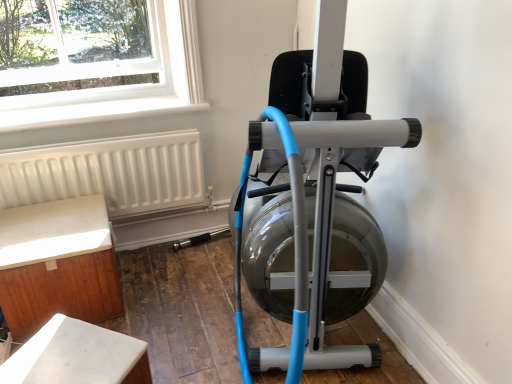
Question: Would you say matte silver stationary bicycle at center is outside white matte radiator at lower left?

Choices:
 (A) no
 (B) yes

Answer: (B)

Question: From a real-world perspective, is matte silver stationary bicycle at center on top of white matte radiator at lower left?

Choices:
 (A) no
 (B) yes

Answer: (B)

Question: Is matte silver stationary bicycle at center further to the viewer compared to white matte radiator at lower left?

Choices:
 (A) yes
 (B) no

Answer: (B)

Question: Is matte silver stationary bicycle at center facing towards white matte radiator at lower left?

Choices:
 (A) yes
 (B) no

Answer: (B)

Question: Does matte silver stationary bicycle at center have a greater width compared to white matte radiator at lower left?

Choices:
 (A) yes
 (B) no

Answer: (A)

Question: Relative to white marble table at lower left, arranged as the 1th furniture when viewed from the front, is white wood cabinet at lower left, which is counted as the first furniture, starting from the back, in front or behind?

Choices:
 (A) behind
 (B) front

Answer: (A)

Question: From a real-world perspective, relative to white marble table at lower left, which is counted as the second furniture, starting from the back, is white wood cabinet at lower left, which is counted as the first furniture, starting from the back, vertically above or below?

Choices:
 (A) above
 (B) below

Answer: (A)

Question: Is point (31, 284) closer or farther from the camera than point (18, 360)?

Choices:
 (A) farther
 (B) closer

Answer: (A)

Question: Based on their sizes in the image, would you say white wood cabinet at lower left, which is counted as the first furniture, starting from the back, is bigger or smaller than white marble table at lower left, arranged as the 1th furniture when viewed from the front?

Choices:
 (A) big
 (B) small

Answer: (A)

Question: From a real-world perspective, is white marble table at lower left, arranged as the 1th furniture when viewed from the front, positioned above or below white matte radiator at lower left?

Choices:
 (A) below
 (B) above

Answer: (A)

Question: Would you say white marble table at lower left, which is counted as the second furniture, starting from the back, is to the left or to the right of white matte radiator at lower left in the picture?

Choices:
 (A) right
 (B) left

Answer: (A)

Question: Which is correct: white marble table at lower left, which is counted as the second furniture, starting from the back, is inside white matte radiator at lower left, or outside of it?

Choices:
 (A) inside
 (B) outside

Answer: (B)

Question: Based on their sizes in the image, would you say white marble table at lower left, arranged as the 1th furniture when viewed from the front, is bigger or smaller than white matte radiator at lower left?

Choices:
 (A) big
 (B) small

Answer: (B)

Question: From a real-world perspective, is matte silver stationary bicycle at center physically located above or below white marble table at lower left, arranged as the 1th furniture when viewed from the front?

Choices:
 (A) above
 (B) below

Answer: (A)

Question: Is point (289, 231) closer or farther from the camera than point (82, 344)?

Choices:
 (A) closer
 (B) farther

Answer: (B)